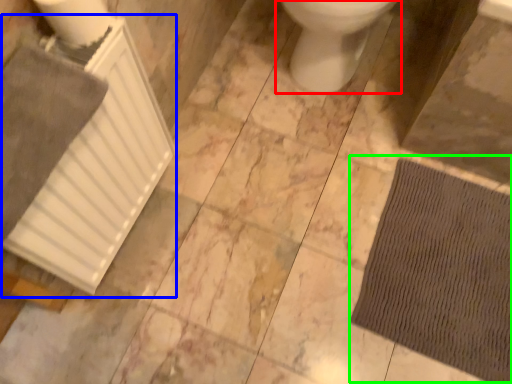
Question: Which object is the closest to the toilet (highlighted by a red box)? Choose among these: radiator (highlighted by a blue box) or doormat (highlighted by a green box).

Choices:
 (A) radiator
 (B) doormat

Answer: (B)